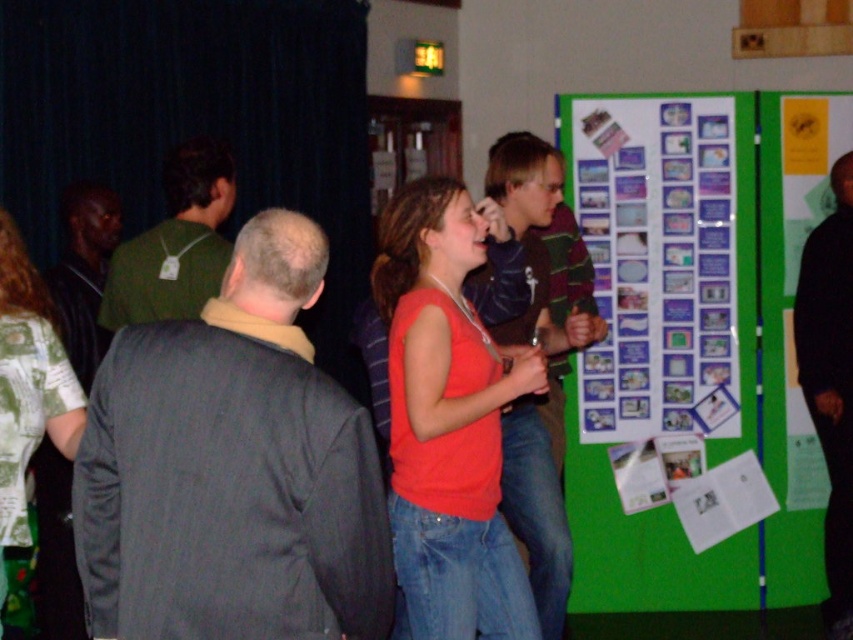
You are attending an event in a dimly lit hall and see two people dressed in matte orange tank top at center and matte black jacket at left. From your perspective, which person is positioned lower in the image?

The matte orange tank top at center is positioned lower than the matte black jacket at left in the image.